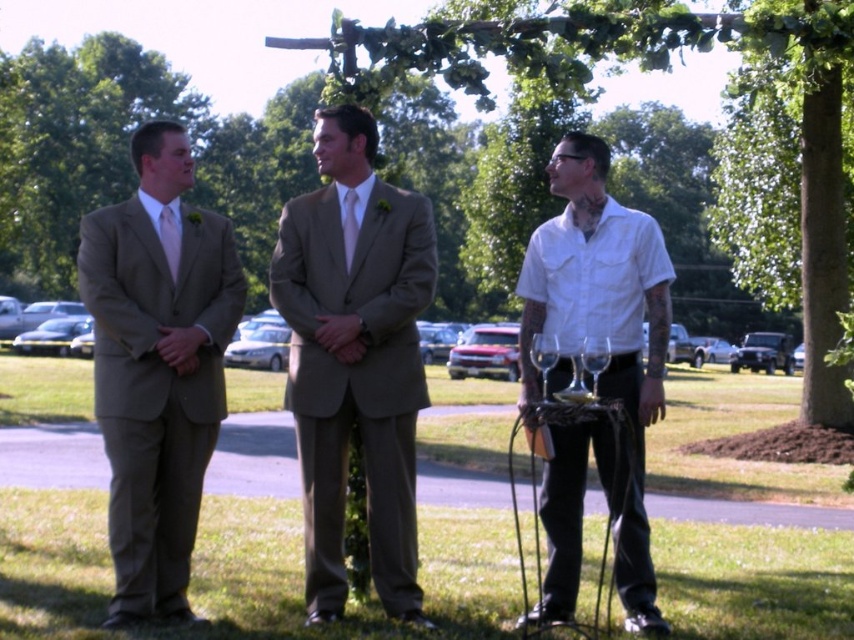
Question: Which point is farther to the camera?

Choices:
 (A) matte pink tie at center
 (B) matte white tie at center
 (C) white matte shirt at center
 (D) matte brown suit at center

Answer: (B)

Question: Does matte brown suit at left appear over matte white tie at center?

Choices:
 (A) no
 (B) yes

Answer: (A)

Question: Is matte brown suit at left thinner than white matte shirt at center?

Choices:
 (A) yes
 (B) no

Answer: (B)

Question: Which of the following is the closest to the observer?

Choices:
 (A) (344, 224)
 (B) (642, 532)
 (C) (174, 266)

Answer: (C)

Question: Which point is closer to the camera?

Choices:
 (A) (360, 371)
 (B) (349, 189)
 (C) (179, 458)
 (D) (601, 211)

Answer: (A)

Question: From the image, what is the correct spatial relationship of matte brown suit at center in relation to matte white tie at center?

Choices:
 (A) above
 (B) below

Answer: (B)